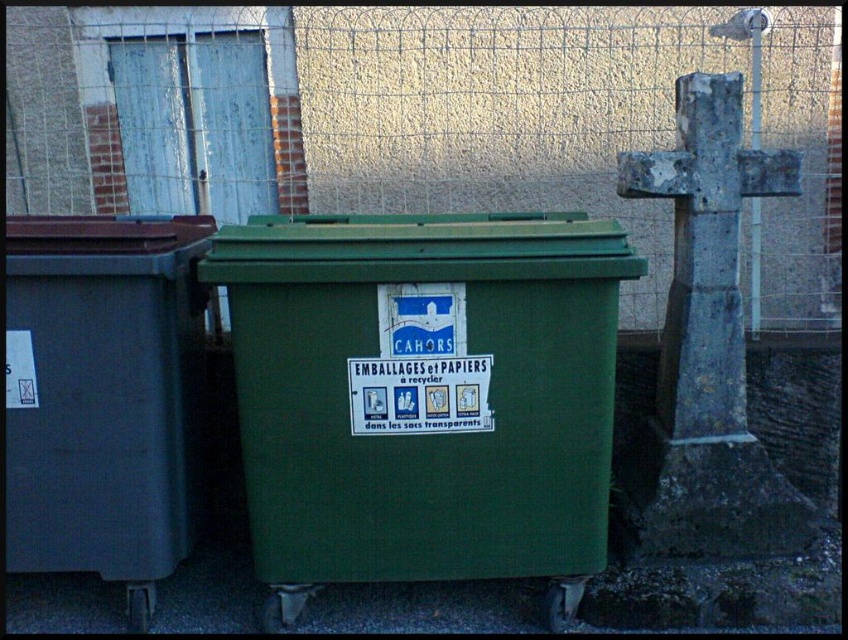
Question: Which point is closer to the camera?

Choices:
 (A) green plastic recycling bin at center
 (B) matte gray recycling bin at left

Answer: (A)

Question: Is green plastic recycling bin at center to the left of matte gray recycling bin at left from the viewer's perspective?

Choices:
 (A) no
 (B) yes

Answer: (A)

Question: Is green plastic recycling bin at center above matte gray recycling bin at left?

Choices:
 (A) no
 (B) yes

Answer: (A)

Question: Is green plastic recycling bin at center behind matte gray recycling bin at left?

Choices:
 (A) no
 (B) yes

Answer: (A)